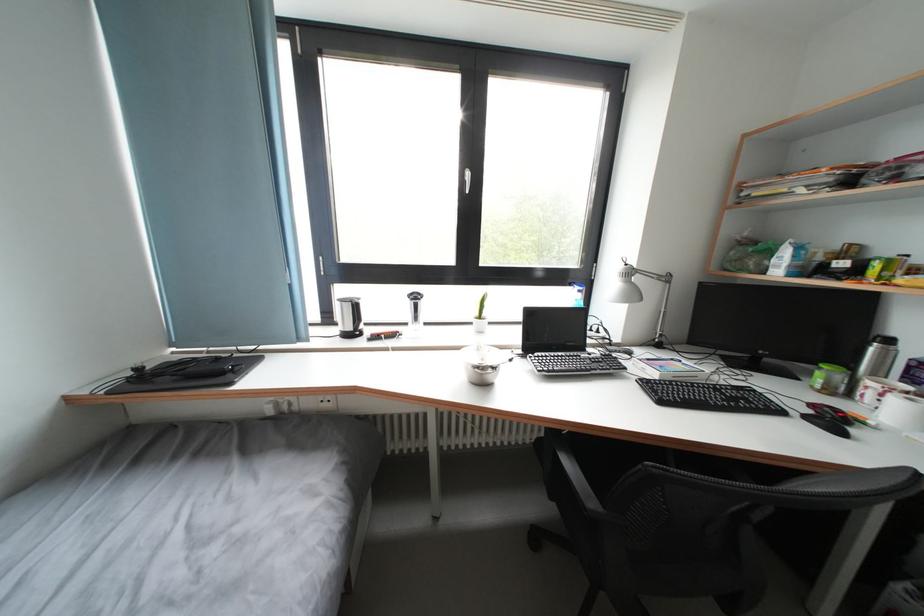
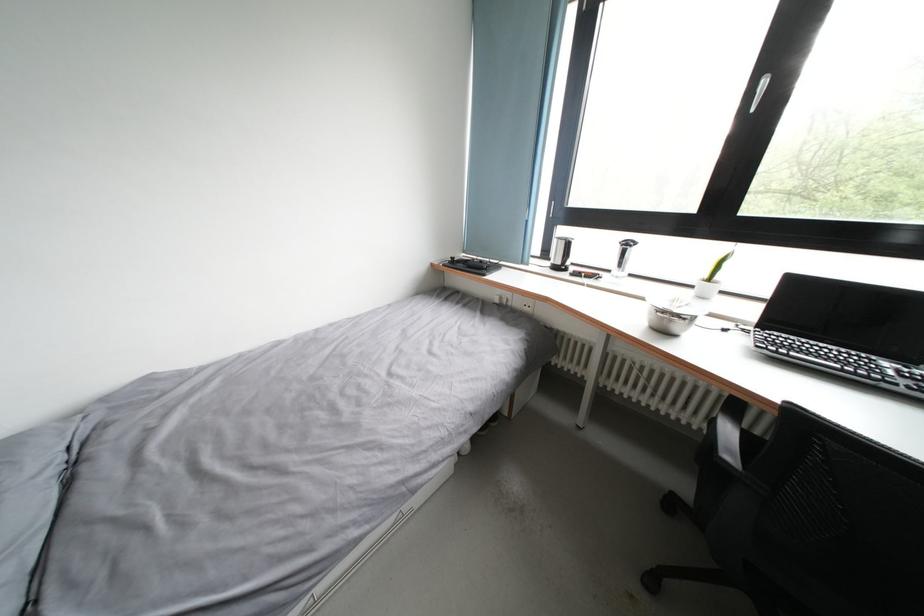
Where in the second image is the point corresponding to [334,325] from the first image?

(552, 259)